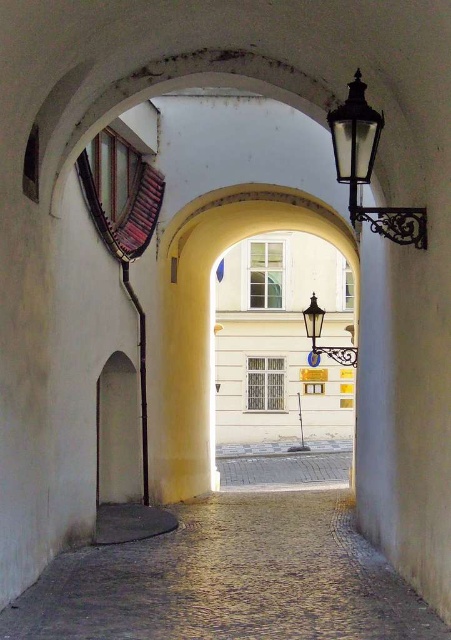
Which of these two, black glass lamp at upper right or polished brass lantern at center, stands shorter?

Answer: black glass lamp at upper right is shorter.

Who is more forward, (367, 216) or (314, 296)?

Point (367, 216) is more forward.

The width and height of the screenshot is (451, 640). I want to click on black glass lamp at upper right, so click(368, 168).

Image resolution: width=451 pixels, height=640 pixels. What are the coordinates of `cobblestone at center` in the screenshot? It's located at (230, 580).

Who is shorter, cobblestone at center or black glass lamp at upper right?

Standing shorter between the two is cobblestone at center.

What do you see at coordinates (230, 580) in the screenshot?
I see `cobblestone at center` at bounding box center [230, 580].

Where is `cobblestone at center`? This screenshot has width=451, height=640. cobblestone at center is located at coordinates (230, 580).

Who is lower down, cobblestone at center or polished brass lantern at center?

cobblestone at center

Does cobblestone at center lie behind polished brass lantern at center?

No, cobblestone at center is closer to the viewer.

Between point (74, 602) and point (312, 349), which one is positioned in front?

Positioned in front is point (74, 602).

You are a GUI agent. You are given a task and a screenshot of the screen. Output one action in this format:
    pyautogui.click(x=<x>, y=<y>)
    Task: Click on the cobblestone at center
    
    Given the screenshot: What is the action you would take?
    pyautogui.click(x=230, y=580)